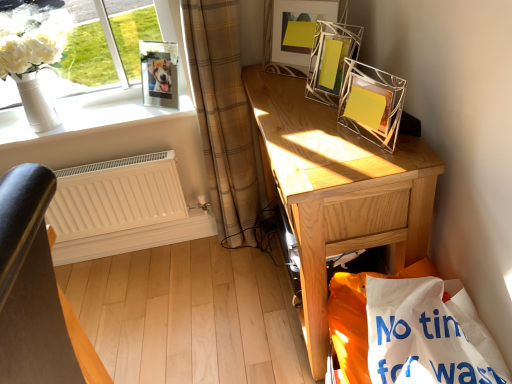
Question: In terms of height, does white paper shopping bag at lower right look taller or shorter compared to beige plaid curtain at left?

Choices:
 (A) tall
 (B) short

Answer: (B)

Question: Considering the positions of white paper shopping bag at lower right and beige plaid curtain at left in the image, is white paper shopping bag at lower right wider or thinner than beige plaid curtain at left?

Choices:
 (A) thin
 (B) wide

Answer: (B)

Question: Estimate the real-world distances between objects in this image. Which object is farther from the metallic wire picture frame at upper center, the 2th picture frame from the left?

Choices:
 (A) beige plaid curtain at left
 (B) white matte radiator at lower left
 (C) white glossy vase at upper left
 (D) metallic wire picture frame at upper right, arranged as the 1th picture frame when viewed from the right
 (E) white paper shopping bag at lower right

Answer: (E)

Question: Considering the real-world distances, which object is closest to the beige plaid curtain at left?

Choices:
 (A) metallic wire picture frame at upper center, which ranks as the second picture frame in right-to-left order
 (B) white paper shopping bag at lower right
 (C) metallic wire picture frame at upper right, arranged as the 1th picture frame when viewed from the right
 (D) clear glass photo frame at upper left, which ranks as the first picture frame in left-to-right order
 (E) light brown wooden desk at right

Answer: (A)